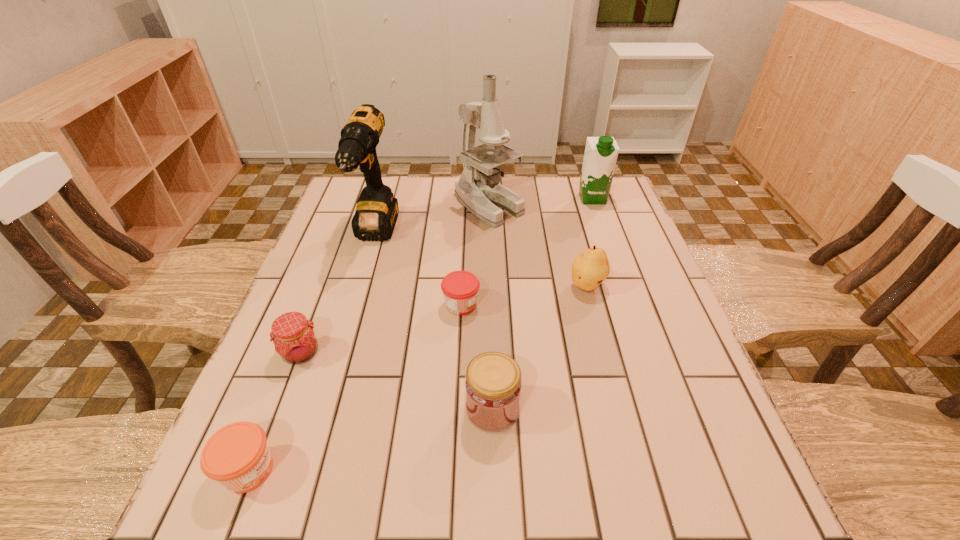
Locate which object is the second closest to the farthest jam. Please provide its 2D coordinates. Your answer should be formatted as a tuple, i.e. [(x, y)], where the tuple contains the x and y coordinates of a point satisfying the conditions above.

[(493, 385)]

I want to click on jam that can be found as the second closest to the second farthest jam, so click(x=460, y=288).

In order to click on jam that is the third closest to the drill in this screenshot , I will do `click(493, 385)`.

You are a GUI agent. You are given a task and a screenshot of the screen. Output one action in this format:
    pyautogui.click(x=<x>, y=<y>)
    Task: Click on the free space that satisfies the following two spatial constraints: 1. on the label side of the second nearest jam; 2. on the right side of the farthest jam
    The image size is (960, 540).
    Given the screenshot: What is the action you would take?
    pyautogui.click(x=457, y=409)

Where is `free region that satisfies the following two spatial constraints: 1. on the front side of the sixth farthest object; 2. on the front label of the nearest jam`? Image resolution: width=960 pixels, height=540 pixels. free region that satisfies the following two spatial constraints: 1. on the front side of the sixth farthest object; 2. on the front label of the nearest jam is located at coordinates (257, 470).

Find the location of a particular element. free space that satisfies the following two spatial constraints: 1. on the label side of the farthest jam; 2. on the back side of the seventh farthest object is located at coordinates (457, 409).

This screenshot has height=540, width=960. Identify the location of blank area in the image that satisfies the following two spatial constraints: 1. on the back side of the seventh farthest object; 2. on the label side of the farthest jam. (490, 305).

Where is `vacant space that satisfies the following two spatial constraints: 1. at the tip of the second nearest object; 2. on the left side of the seventh shortest object`? This screenshot has width=960, height=540. vacant space that satisfies the following two spatial constraints: 1. at the tip of the second nearest object; 2. on the left side of the seventh shortest object is located at coordinates (324, 409).

The image size is (960, 540). What are the coordinates of `free spot that satisfies the following two spatial constraints: 1. on the front-facing side of the sixth shortest object; 2. on the front label of the nearest object` in the screenshot? It's located at pyautogui.click(x=688, y=470).